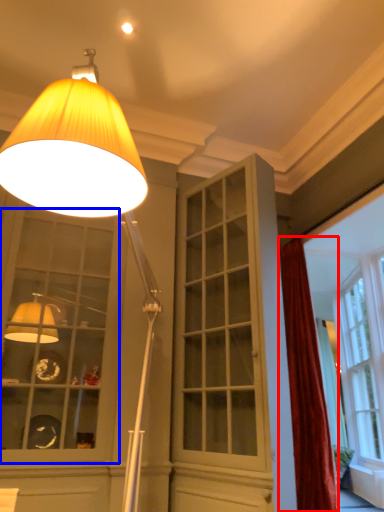
Question: Which point is further to the camera, curtain (highlighted by a red box) or window (highlighted by a blue box)?

Choices:
 (A) curtain
 (B) window

Answer: (A)